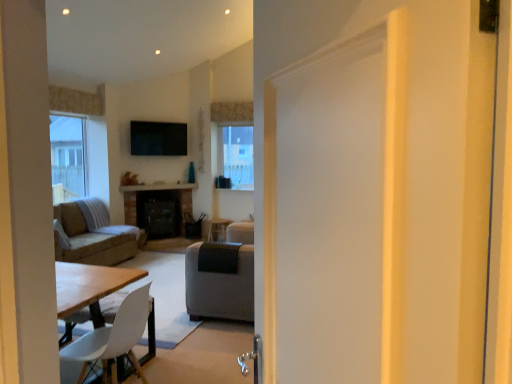
Question: Considering the relative sizes of soft gray fabric couch at left and white matte chair at lower left in the image provided, is soft gray fabric couch at left wider than white matte chair at lower left?

Choices:
 (A) no
 (B) yes

Answer: (B)

Question: Is there a large distance between soft gray fabric couch at left and white matte chair at lower left?

Choices:
 (A) no
 (B) yes

Answer: (B)

Question: Is soft gray fabric couch at left to the right of white matte chair at lower left from the viewer's perspective?

Choices:
 (A) yes
 (B) no

Answer: (B)

Question: Is the surface of soft gray fabric couch at left in direct contact with white matte chair at lower left?

Choices:
 (A) no
 (B) yes

Answer: (A)

Question: Can you confirm if soft gray fabric couch at left is bigger than white matte chair at lower left?

Choices:
 (A) yes
 (B) no

Answer: (A)

Question: Is soft gray fabric couch at left smaller than white matte chair at lower left?

Choices:
 (A) yes
 (B) no

Answer: (B)

Question: Is white matte chair at lower left located outside soft gray fabric couch at left?

Choices:
 (A) no
 (B) yes

Answer: (B)

Question: Is white matte chair at lower left oriented away from soft gray fabric couch at left?

Choices:
 (A) no
 (B) yes

Answer: (A)

Question: Is white matte chair at lower left not close to soft gray fabric couch at left?

Choices:
 (A) yes
 (B) no

Answer: (A)

Question: Does white matte chair at lower left lie in front of soft gray fabric couch at left?

Choices:
 (A) yes
 (B) no

Answer: (A)

Question: Is white matte chair at lower left to the right of soft gray fabric couch at left from the viewer's perspective?

Choices:
 (A) no
 (B) yes

Answer: (B)

Question: From a real-world perspective, is white matte chair at lower left on top of soft gray fabric couch at left?

Choices:
 (A) no
 (B) yes

Answer: (A)

Question: From a real-world perspective, is white matte chair at lower left above or below soft gray fabric couch at left?

Choices:
 (A) below
 (B) above

Answer: (A)